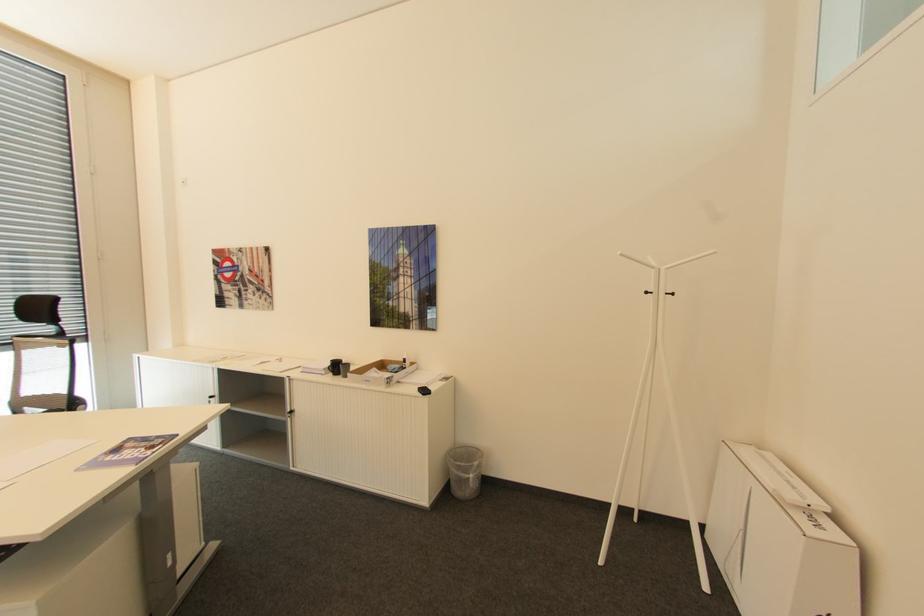
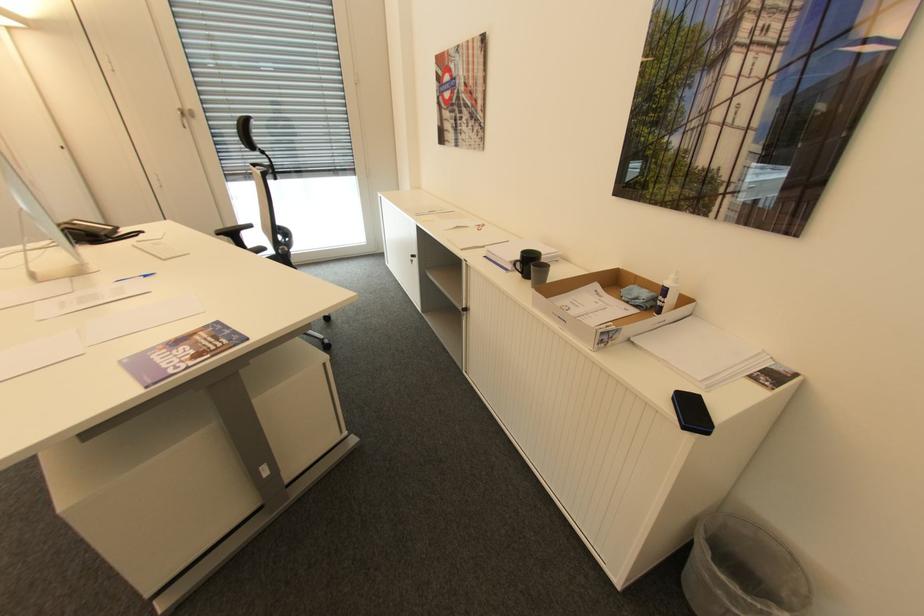
Locate, in the second image, the point that corresponds to point (458, 471) in the first image.

(711, 576)